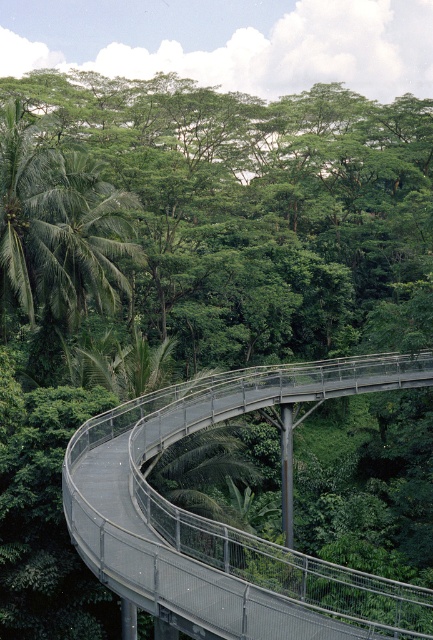
You are a hiker who wants to cross the metallic gray pedestrian bridge at center. There is a green leafy palm at left nearby. Which object is wider?

The metallic gray pedestrian bridge at center is wider than the green leafy palm at left.

You are standing on the curved pedestrian bridge in the tropical forest scene. You notice two points marked on the bridge. One is at coordinate point (x=161, y=509) and the other at point (x=23, y=192). Which of these two points is nearer to you as you stand on the bridge?

Point (x=161, y=509) is closer to the viewer than point (x=23, y=192).